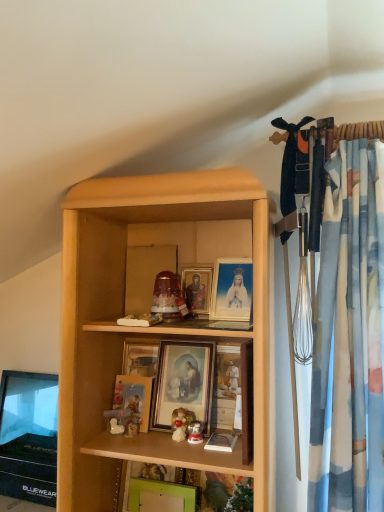
Question: Is matte gold picture frame at center, positioned as the second picture frame in bottom-to-top order, shorter than green matte picture frame at lower center, which appears as the first picture frame when ordered from the bottom?

Choices:
 (A) yes
 (B) no

Answer: (B)

Question: Is matte gold picture frame at center, positioned as the second picture frame in bottom-to-top order, far from green matte picture frame at lower center, which appears as the first picture frame when ordered from the bottom?

Choices:
 (A) yes
 (B) no

Answer: (B)

Question: From a real-world perspective, is matte gold picture frame at center, positioned as the second picture frame in bottom-to-top order, on top of green matte picture frame at lower center, positioned as the 4th picture frame in top-to-bottom order?

Choices:
 (A) yes
 (B) no

Answer: (A)

Question: From a real-world perspective, is matte gold picture frame at center, acting as the third picture frame starting from the top, under green matte picture frame at lower center, which appears as the first picture frame when ordered from the bottom?

Choices:
 (A) no
 (B) yes

Answer: (A)

Question: Is matte gold picture frame at center, positioned as the second picture frame in bottom-to-top order, at the left side of green matte picture frame at lower center, which appears as the first picture frame when ordered from the bottom?

Choices:
 (A) no
 (B) yes

Answer: (B)

Question: In terms of size, does matte gold picture frame at center, positioned as the second picture frame in bottom-to-top order, appear bigger or smaller than wooden picture frame at center, acting as the 4th picture frame starting from the bottom?

Choices:
 (A) small
 (B) big

Answer: (B)

Question: Considering their positions, is matte gold picture frame at center, acting as the third picture frame starting from the top, located in front of or behind wooden picture frame at center, acting as the 4th picture frame starting from the bottom?

Choices:
 (A) front
 (B) behind

Answer: (A)

Question: From their relative heights in the image, would you say matte gold picture frame at center, acting as the third picture frame starting from the top, is taller or shorter than wooden picture frame at center, placed as the first picture frame when sorted from top to bottom?

Choices:
 (A) tall
 (B) short

Answer: (A)

Question: Is matte gold picture frame at center, acting as the third picture frame starting from the top, inside or outside of wooden picture frame at center, placed as the first picture frame when sorted from top to bottom?

Choices:
 (A) inside
 (B) outside

Answer: (B)

Question: Is point (190, 304) closer or farther from the camera than point (117, 389)?

Choices:
 (A) farther
 (B) closer

Answer: (A)

Question: In terms of size, does wooden picture frame at center, placed as the first picture frame when sorted from top to bottom, appear bigger or smaller than matte gold picture frame at center, acting as the third picture frame starting from the top?

Choices:
 (A) small
 (B) big

Answer: (A)

Question: Would you say wooden picture frame at center, placed as the first picture frame when sorted from top to bottom, is to the left or to the right of matte gold picture frame at center, positioned as the second picture frame in bottom-to-top order, in the picture?

Choices:
 (A) right
 (B) left

Answer: (A)

Question: Looking at their shapes, would you say wooden picture frame at center, acting as the 4th picture frame starting from the bottom, is wider or thinner than matte gold picture frame at center, positioned as the second picture frame in bottom-to-top order?

Choices:
 (A) thin
 (B) wide

Answer: (B)

Question: Considering the positions of matte gold picture frame at center, acting as the third picture frame starting from the top, and matte gold picture frame at center, marked as the 2th picture frame in a top-to-bottom arrangement, in the image, is matte gold picture frame at center, acting as the third picture frame starting from the top, wider or thinner than matte gold picture frame at center, marked as the 2th picture frame in a top-to-bottom arrangement,?

Choices:
 (A) thin
 (B) wide

Answer: (A)

Question: From their relative heights in the image, would you say matte gold picture frame at center, acting as the third picture frame starting from the top, is taller or shorter than matte gold picture frame at center, the 3th picture frame when ordered from bottom to top?

Choices:
 (A) short
 (B) tall

Answer: (A)